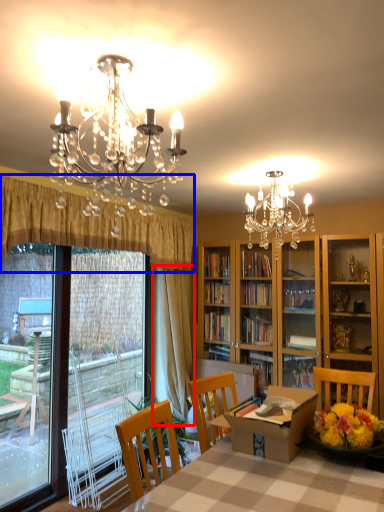
Question: Which point is further to the camera, curtain (highlighted by a red box) or curtain (highlighted by a blue box)?

Choices:
 (A) curtain
 (B) curtain

Answer: (A)